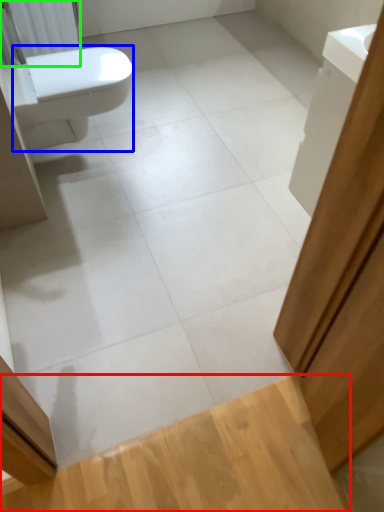
Question: Estimate the real-world distances between objects in this image. Which object is closer to plank (highlighted by a red box), bidet (highlighted by a blue box) or radiator (highlighted by a green box)?

Choices:
 (A) bidet
 (B) radiator

Answer: (A)